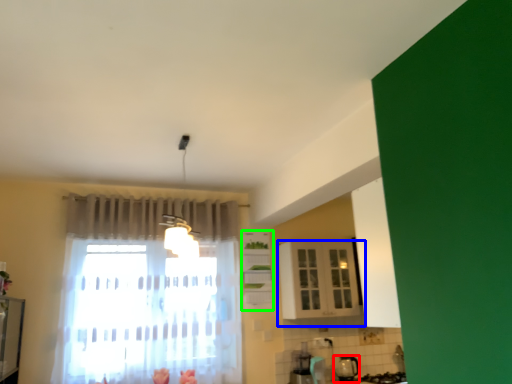
Question: Which object is positioned farthest from appliance (highlighted by a red box)? Select from cabinetry (highlighted by a blue box) and cabinetry (highlighted by a green box).

Choices:
 (A) cabinetry
 (B) cabinetry

Answer: (B)